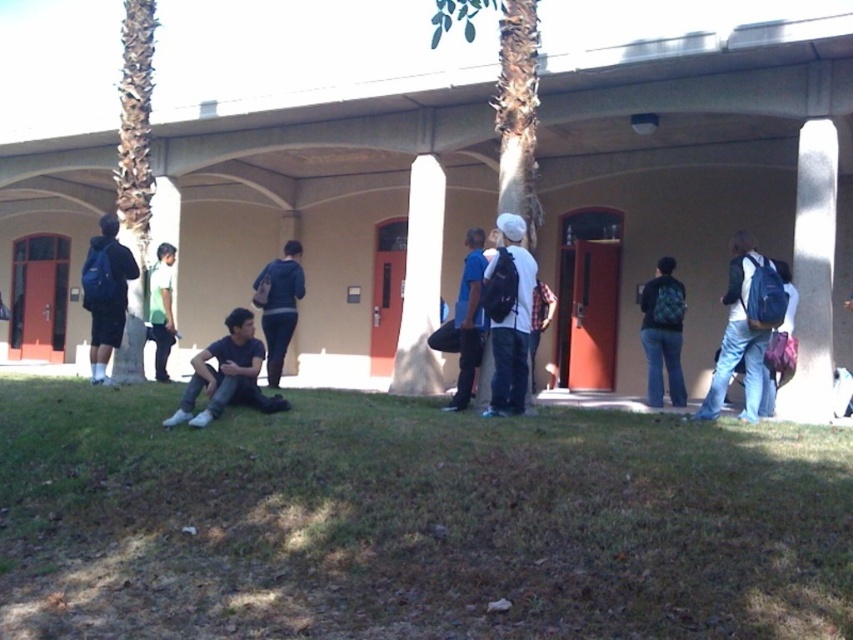
Question: Among these objects, which one is nearest to the camera?

Choices:
 (A) matte blue backpack at left
 (B) denim backpack at right
 (C) matte black backpack at center
 (D) dark blue jeans at lower left

Answer: (D)

Question: Which of the following is the farthest from the observer?

Choices:
 (A) (749, 408)
 (B) (650, 301)
 (C) (514, 385)
 (D) (117, 204)

Answer: (D)

Question: Is denim backpack at right bigger than matte blue backpack at left?

Choices:
 (A) no
 (B) yes

Answer: (B)

Question: Is denim backpack at right to the left of matte blue backpack at left from the viewer's perspective?

Choices:
 (A) yes
 (B) no

Answer: (B)

Question: Is green grass at lower left to the left of matte blue backpack at left from the viewer's perspective?

Choices:
 (A) yes
 (B) no

Answer: (B)

Question: Which of these objects is positioned closest to the white smooth pillar at center?

Choices:
 (A) green grass at lower left
 (B) matte blue hoodie at center
 (C) blue backpack at center

Answer: (B)